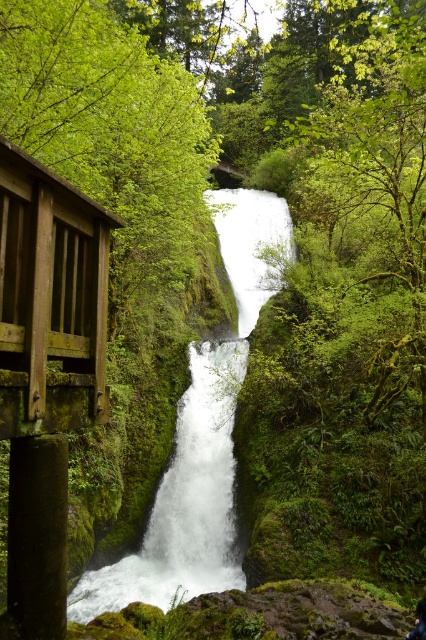
You are a hiker who wants to place a 10 meter long rope between the white frothy water at center and the dark blue fabric at lower right. Will the rope be long enough?

The distance between the white frothy water at center and the dark blue fabric at lower right is 9.91 meters. Since the rope is 10 meters long, it will be long enough to span the distance between them.

You are standing at the viewpoint and want to know how far the point at coordinates (x=267, y=196) is from your current position. Can you determine the distance?

The point at coordinates (x=267, y=196) is 38.79 meters away from your current position.

You are standing at the camera position and want to take a photo of the white smooth waterfall at center. If your camera has a maximum focus range of 8 meters, will you be able to capture the waterfall clearly?

The white smooth waterfall at center and camera are 8.25 meters apart from each other. Since the distance exceeds the camera maximum focus range of 8 meters, you won not be able to capture the waterfall clearly.